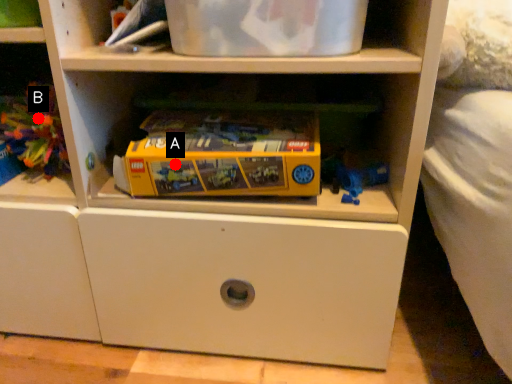
Question: Two points are circled on the image, labeled by A and B beside each circle. Which point is closer to the camera?

Choices:
 (A) A is closer
 (B) B is closer

Answer: (A)